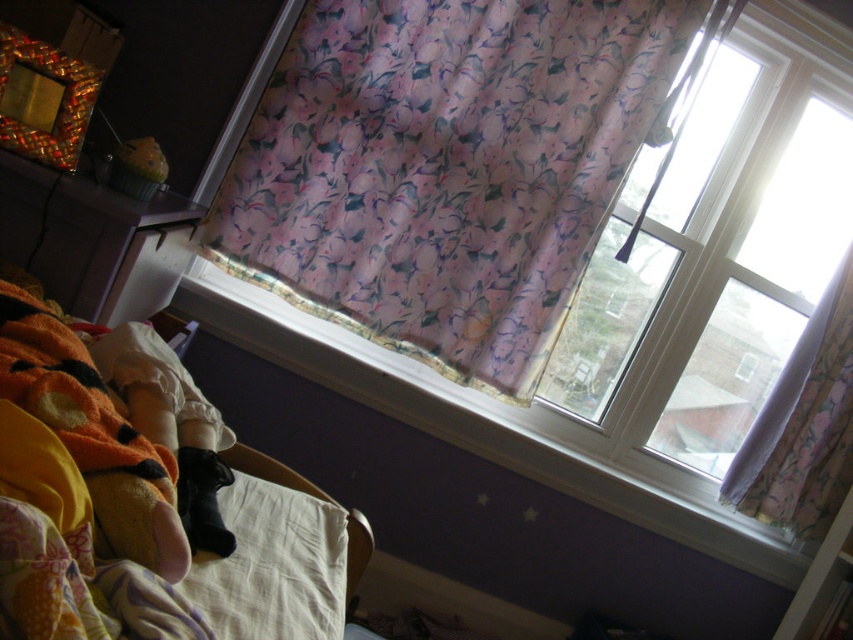
Who is positioned more to the right, floral fabric curtain at upper center or white cotton pillow at lower left?

floral fabric curtain at upper center is more to the right.

Which is above, floral fabric curtain at upper center or white cotton pillow at lower left?

Positioned higher is floral fabric curtain at upper center.

The width and height of the screenshot is (853, 640). I want to click on floral fabric curtain at upper center, so click(451, 166).

Does pink floral fabric at upper center have a greater width compared to white cotton pillow at lower left?

Yes.

Who is taller, pink floral fabric at upper center or white cotton pillow at lower left?

pink floral fabric at upper center

At what (x,y) coordinates should I click in order to perform the action: click on pink floral fabric at upper center. Please return your answer as a coordinate pair (x, y). Looking at the image, I should click on (491, 426).

Can you confirm if fluffy yellow fabric at lower left is thinner than white cotton pillow at lower left?

Incorrect, fluffy yellow fabric at lower left's width is not less than white cotton pillow at lower left's.

Looking at this image, can you confirm if fluffy yellow fabric at lower left is smaller than white cotton pillow at lower left?

Actually, fluffy yellow fabric at lower left might be larger than white cotton pillow at lower left.

Locate an element on the screen. This screenshot has height=640, width=853. fluffy yellow fabric at lower left is located at coordinates (140, 500).